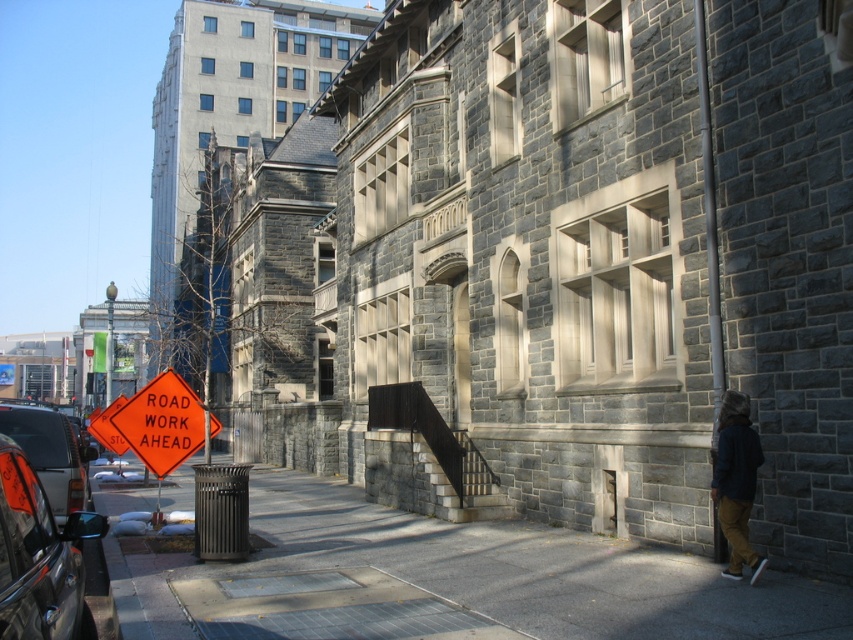
You are a delivery person approaching the building and need to park your vehicle. The parking spot is marked on the smooth concrete pavement at lower center. However, there is an orange plastic sign at lower left nearby. Where exactly should you place your vehicle to avoid blocking the sign?

The smooth concrete pavement at lower center is located below the orange plastic sign at lower left. To avoid blocking the sign, park your vehicle on the smooth concrete pavement at lower center, which is positioned underneath the sign, ensuring the sign remains visible and unobstructed.

You are a pedestrian walking on the sidewalk in the scene. You notice the orange plastic sign at lower left and the dark blue jacket at lower right. Which object is positioned higher from the ground?

The orange plastic sign at lower left is above dark blue jacket at lower right, so the orange plastic sign at lower left is higher from the ground.

You are a pedestrian walking on the sidewalk in this urban street scene. You see a shiny black car at left and a dark blue jacket at lower right. Which object is positioned more to the left?

The shiny black car at left is positioned more to the left than the dark blue jacket at lower right.